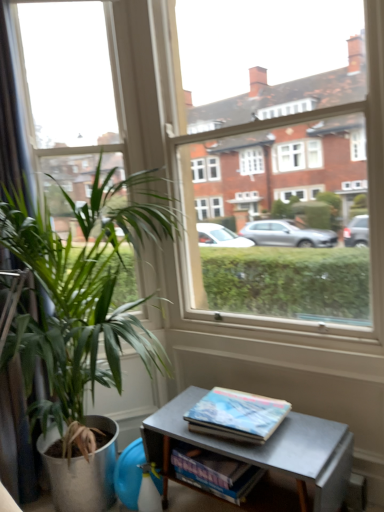
Identify the location of vacant area that lies in front of hardcover book at lower right. The height and width of the screenshot is (512, 384). (266, 452).